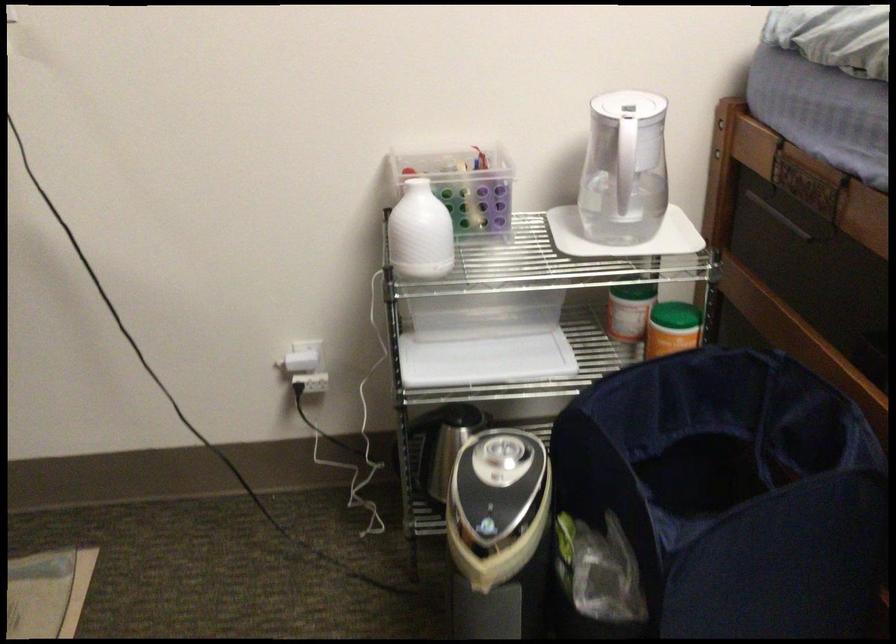
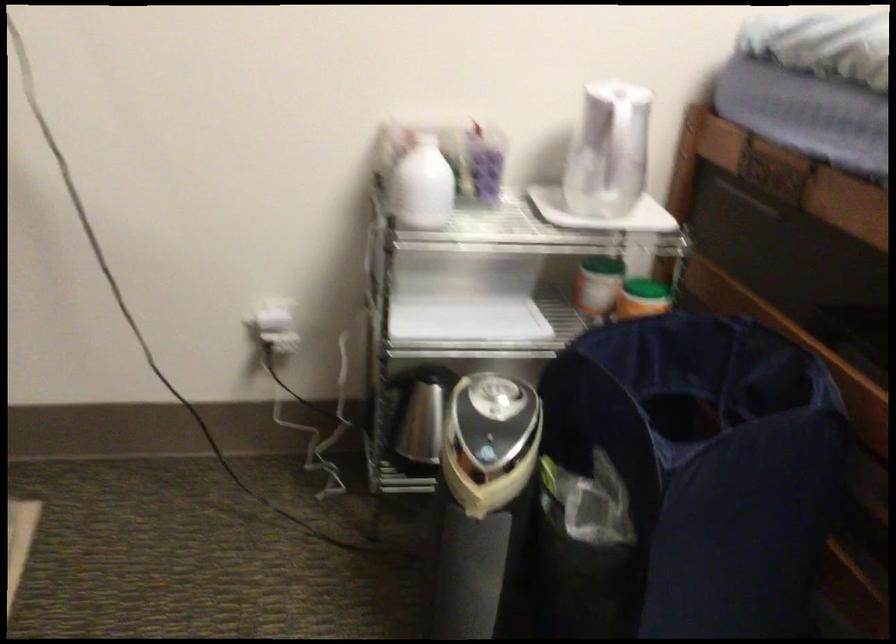
Find the pixel in the second image that matches point (669, 325) in the first image.

(642, 298)